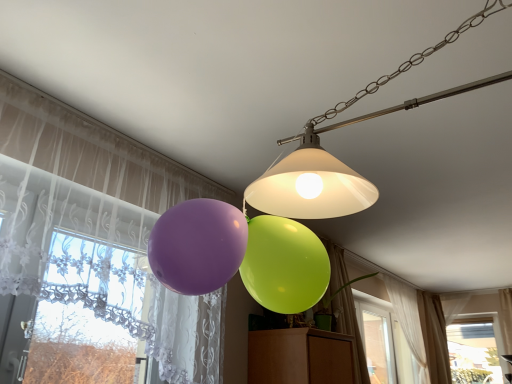
Measure the distance between transparent glass window at lower right and camera.

The depth of transparent glass window at lower right is 5.67 meters.

This screenshot has width=512, height=384. What do you see at coordinates (434, 337) in the screenshot?
I see `beige sheer curtain at lower right, positioned as the fourth curtain in left-to-right order` at bounding box center [434, 337].

Where is `matte white lampshade at upper center`? matte white lampshade at upper center is located at coordinates (336, 158).

I want to click on transparent glass window at lower right, so (x=475, y=350).

Is green fabric curtain at lower right, acting as the third curtain starting from the right, oriented towards sheer white curtain at lower right, which is the second curtain in right-to-left order?

No.

From a real-world perspective, is green fabric curtain at lower right, arranged as the second curtain when viewed from the front, physically located above or below sheer white curtain at lower right, which is the second curtain in right-to-left order?

green fabric curtain at lower right, arranged as the second curtain when viewed from the front, is below sheer white curtain at lower right, which is the second curtain in right-to-left order.

How different are the orientations of green fabric curtain at lower right, the 3th curtain when ordered from back to front, and sheer white curtain at lower right, placed as the third curtain when sorted from left to right, in degrees?

The angle between the facing direction of green fabric curtain at lower right, the 3th curtain when ordered from back to front, and the facing direction of sheer white curtain at lower right, placed as the third curtain when sorted from left to right, is 0.394 degrees.

Based on the photo, looking at their sizes, would you say green fabric curtain at lower right, the 3th curtain when ordered from back to front, is wider or thinner than sheer white curtain at lower right, which ranks as the second curtain in back-to-front order?

Considering their sizes, green fabric curtain at lower right, the 3th curtain when ordered from back to front, looks broader than sheer white curtain at lower right, which ranks as the second curtain in back-to-front order.

How different are the orientations of transparent glass window at lower right and translucent fabric curtain at left, the 4th curtain when ordered from back to front, in degrees?

The angular difference between transparent glass window at lower right and translucent fabric curtain at left, the 4th curtain when ordered from back to front, is 88.8 degrees.

Could you tell me if transparent glass window at lower right is facing translucent fabric curtain at left, which is the fourth curtain in right-to-left order?

Yes, transparent glass window at lower right is aimed at translucent fabric curtain at left, which is the fourth curtain in right-to-left order.

Considering the relative positions of transparent glass window at lower right and translucent fabric curtain at left, which is the fourth curtain in right-to-left order, in the image provided, is transparent glass window at lower right to the right of translucent fabric curtain at left, which is the fourth curtain in right-to-left order, from the viewer's perspective?

Indeed, transparent glass window at lower right is positioned on the right side of translucent fabric curtain at left, which is the fourth curtain in right-to-left order.

Does transparent glass window at lower right have a smaller size compared to translucent fabric curtain at left, which is the fourth curtain in right-to-left order?

Yes.

Is point (131, 293) more distant than point (443, 349)?

No, it is in front of (443, 349).

Is translucent fabric curtain at left, the 4th curtain when ordered from back to front, not inside beige sheer curtain at lower right, the fourth curtain viewed from the front?

That's correct, translucent fabric curtain at left, the 4th curtain when ordered from back to front, is outside of beige sheer curtain at lower right, the fourth curtain viewed from the front.

Can you tell me how much translucent fabric curtain at left, the 1th curtain from the front, and beige sheer curtain at lower right, the 1th curtain viewed from the right, differ in facing direction?

The angular difference between translucent fabric curtain at left, the 1th curtain from the front, and beige sheer curtain at lower right, the 1th curtain viewed from the right, is 0.857 degrees.

Can you confirm if translucent fabric curtain at left, the 1th curtain from the front, is bigger than beige sheer curtain at lower right, the fourth curtain viewed from the front?

Correct, translucent fabric curtain at left, the 1th curtain from the front, is larger in size than beige sheer curtain at lower right, the fourth curtain viewed from the front.

Considering the relative sizes of transparent glass window at lower right and green fabric curtain at lower right, the 3th curtain when ordered from back to front, in the image provided, is transparent glass window at lower right thinner than green fabric curtain at lower right, the 3th curtain when ordered from back to front,?

Yes, transparent glass window at lower right is thinner than green fabric curtain at lower right, the 3th curtain when ordered from back to front.

Which is in front, point (488, 379) or point (345, 287)?

Point (345, 287)

From a real-world perspective, who is located higher, transparent glass window at lower right or green fabric curtain at lower right, arranged as the second curtain when viewed from the front?

green fabric curtain at lower right, arranged as the second curtain when viewed from the front.

Could you measure the distance between beige sheer curtain at lower right, the 1th curtain viewed from the right, and translucent fabric curtain at left, which is the fourth curtain in right-to-left order?

They are 15.06 feet apart.

Who is bigger, beige sheer curtain at lower right, the fourth curtain viewed from the front, or translucent fabric curtain at left, the 4th curtain when ordered from back to front?

translucent fabric curtain at left, the 4th curtain when ordered from back to front, is bigger.

Is beige sheer curtain at lower right, positioned as the first curtain in back-to-front order, oriented towards translucent fabric curtain at left, which is the fourth curtain in right-to-left order?

No, beige sheer curtain at lower right, positioned as the first curtain in back-to-front order, is not facing towards translucent fabric curtain at left, which is the fourth curtain in right-to-left order.

Looking at their sizes, would you say beige sheer curtain at lower right, positioned as the fourth curtain in left-to-right order, is wider or thinner than translucent fabric curtain at left, which is the fourth curtain in right-to-left order?

beige sheer curtain at lower right, positioned as the fourth curtain in left-to-right order, is wider than translucent fabric curtain at left, which is the fourth curtain in right-to-left order.

In the image, is green fabric curtain at lower right, the 3th curtain when ordered from back to front, positioned in front of or behind matte white lampshade at upper center?

green fabric curtain at lower right, the 3th curtain when ordered from back to front, is positioned farther from the viewer than matte white lampshade at upper center.

From the image's perspective, which is above, green fabric curtain at lower right, acting as the 2th curtain starting from the left, or matte white lampshade at upper center?

From the image's view, matte white lampshade at upper center is above.

Does green fabric curtain at lower right, acting as the third curtain starting from the right, have a larger size compared to matte white lampshade at upper center?

Correct, green fabric curtain at lower right, acting as the third curtain starting from the right, is larger in size than matte white lampshade at upper center.

Could you tell me if beige sheer curtain at lower right, positioned as the first curtain in back-to-front order, is turned towards transparent glass window at lower right?

No, beige sheer curtain at lower right, positioned as the first curtain in back-to-front order, is not aimed at transparent glass window at lower right.

At what (x,y) coordinates should I click in order to perform the action: click on curtain that is the 1st object located in front of the transparent glass window at lower right. Please return your answer as a coordinate pair (x, y). Looking at the image, I should click on (434, 337).

Does beige sheer curtain at lower right, the fourth curtain viewed from the front, have a lesser height compared to transparent glass window at lower right?

Incorrect, the height of beige sheer curtain at lower right, the fourth curtain viewed from the front, does not fall short of that of transparent glass window at lower right.

Do you think beige sheer curtain at lower right, positioned as the fourth curtain in left-to-right order, is within transparent glass window at lower right, or outside of it?

beige sheer curtain at lower right, positioned as the fourth curtain in left-to-right order, is spatially situated outside transparent glass window at lower right.

This screenshot has height=384, width=512. Find the location of `the 2nd curtain directly above the green fabric curtain at lower right, the 3th curtain when ordered from back to front (from a real-world perspective)`. the 2nd curtain directly above the green fabric curtain at lower right, the 3th curtain when ordered from back to front (from a real-world perspective) is located at coordinates (408, 321).

The height and width of the screenshot is (384, 512). What are the coordinates of `the 4th curtain in front of the transparent glass window at lower right, starting your count from the anchor` in the screenshot? It's located at (94, 248).

Considering their positions, is matte white lampshade at upper center positioned further to beige sheer curtain at lower right, positioned as the fourth curtain in left-to-right order, than transparent glass window at lower right?

Among the two, matte white lampshade at upper center is located further to beige sheer curtain at lower right, positioned as the fourth curtain in left-to-right order.

Which object lies nearer to the anchor point matte white lampshade at upper center, beige sheer curtain at lower right, the 1th curtain viewed from the right, or green fabric curtain at lower right, arranged as the second curtain when viewed from the front?

green fabric curtain at lower right, arranged as the second curtain when viewed from the front, is positioned closer to the anchor matte white lampshade at upper center.

Which object lies nearer to the anchor point sheer white curtain at lower right, the 3th curtain positioned from the front, matte white lampshade at upper center or green fabric curtain at lower right, arranged as the second curtain when viewed from the front?

Based on the image, green fabric curtain at lower right, arranged as the second curtain when viewed from the front, appears to be nearer to sheer white curtain at lower right, the 3th curtain positioned from the front.

Based on their spatial positions, is translucent fabric curtain at left, the 4th curtain when ordered from back to front, or green fabric curtain at lower right, acting as the third curtain starting from the right, further from beige sheer curtain at lower right, the fourth curtain viewed from the front?

translucent fabric curtain at left, the 4th curtain when ordered from back to front.

Based on their spatial positions, is transparent glass window at lower right or translucent fabric curtain at left, the 4th curtain when ordered from back to front, closer to sheer white curtain at lower right, which is the second curtain in right-to-left order?

transparent glass window at lower right is positioned closer to the anchor sheer white curtain at lower right, which is the second curtain in right-to-left order.

Based on their spatial positions, is transparent glass window at lower right or beige sheer curtain at lower right, positioned as the fourth curtain in left-to-right order, closer to green fabric curtain at lower right, acting as the third curtain starting from the right?

beige sheer curtain at lower right, positioned as the fourth curtain in left-to-right order.

Based on their spatial positions, is green fabric curtain at lower right, acting as the third curtain starting from the right, or beige sheer curtain at lower right, the fourth curtain viewed from the front, closer to translucent fabric curtain at left, the 1th curtain from the front?

The object closer to translucent fabric curtain at left, the 1th curtain from the front, is green fabric curtain at lower right, acting as the third curtain starting from the right.

From the image, which object appears to be nearer to sheer white curtain at lower right, the 3th curtain positioned from the front, translucent fabric curtain at left, which is the fourth curtain in right-to-left order, or matte white lampshade at upper center?

Among the two, translucent fabric curtain at left, which is the fourth curtain in right-to-left order, is located nearer to sheer white curtain at lower right, the 3th curtain positioned from the front.

Locate an element on the screen. curtain between matte white lampshade at upper center and green fabric curtain at lower right, acting as the 2th curtain starting from the left, along the z-axis is located at coordinates (94, 248).

The image size is (512, 384). I want to click on curtain located between sheer white curtain at lower right, which is the second curtain in right-to-left order, and transparent glass window at lower right in the left-right direction, so coord(434,337).

Find the location of `curtain located between green fabric curtain at lower right, acting as the 2th curtain starting from the left, and beige sheer curtain at lower right, the 1th curtain viewed from the right, in the depth direction`. curtain located between green fabric curtain at lower right, acting as the 2th curtain starting from the left, and beige sheer curtain at lower right, the 1th curtain viewed from the right, in the depth direction is located at coordinates (408, 321).

Locate an element on the screen. This screenshot has width=512, height=384. curtain between translucent fabric curtain at left, which is the fourth curtain in right-to-left order, and sheer white curtain at lower right, the 3th curtain positioned from the front, in the front-back direction is located at coordinates (350, 331).